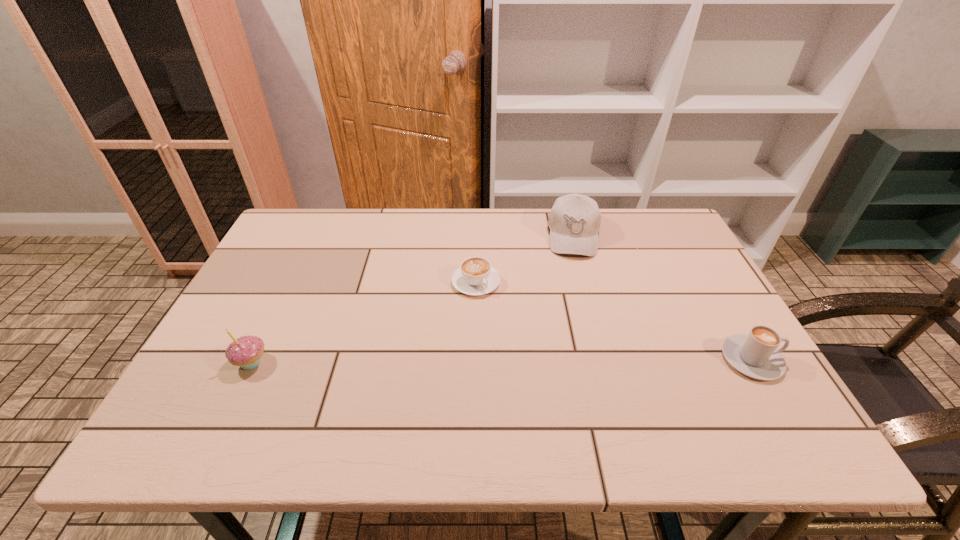
Find the location of a particular element. The width and height of the screenshot is (960, 540). free spot on the desktop that is between the cupcake and the right cappuccino and is positioned on the side of the shortest object with the handle is located at coordinates [536, 360].

You are a GUI agent. You are given a task and a screenshot of the screen. Output one action in this format:
    pyautogui.click(x=<x>, y=<y>)
    Task: Click on the free spot on the desktop that is between the leftmost object and the taller cappuccino and is positioned on the front-facing side of the farthest object
    
    Given the screenshot: What is the action you would take?
    pyautogui.click(x=575, y=360)